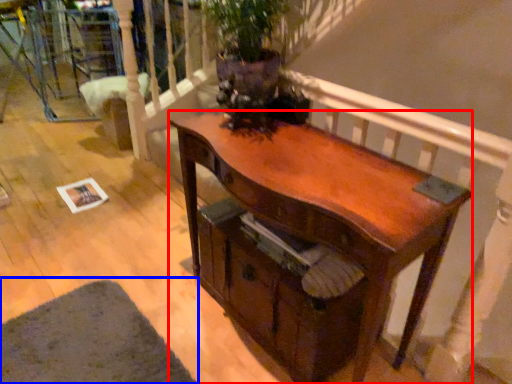
Question: Which of the following is the closest to the observer, desk (highlighted by a red box) or mat (highlighted by a blue box)?

Choices:
 (A) desk
 (B) mat

Answer: (A)